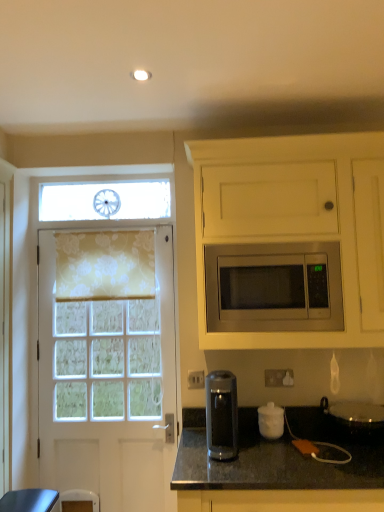
Question: Do you think transparent plastic coffee machine at lower center is within stainless steel microwave at center, or outside of it?

Choices:
 (A) outside
 (B) inside

Answer: (A)

Question: Looking at the image, does transparent plastic coffee machine at lower center seem bigger or smaller compared to stainless steel microwave at center?

Choices:
 (A) small
 (B) big

Answer: (A)

Question: Estimate the real-world distances between objects in this image. Which object is closer to the white floral fabric at left?

Choices:
 (A) black granite countertop at lower center
 (B) white matte jar at lower center, the 2th appliance from the right
 (C) floral fabric curtain at left
 (D) white matte cabinet at upper right
 (E) stainless steel microwave at center

Answer: (C)

Question: Which of these objects is positioned farthest from the stainless steel microwave at center?

Choices:
 (A) black granite countertop at lower center
 (B) white matte cabinet at upper right
 (C) floral fabric curtain at left
 (D) white plastic electric outlet at lower center
 (E) white floral fabric at left

Answer: (E)